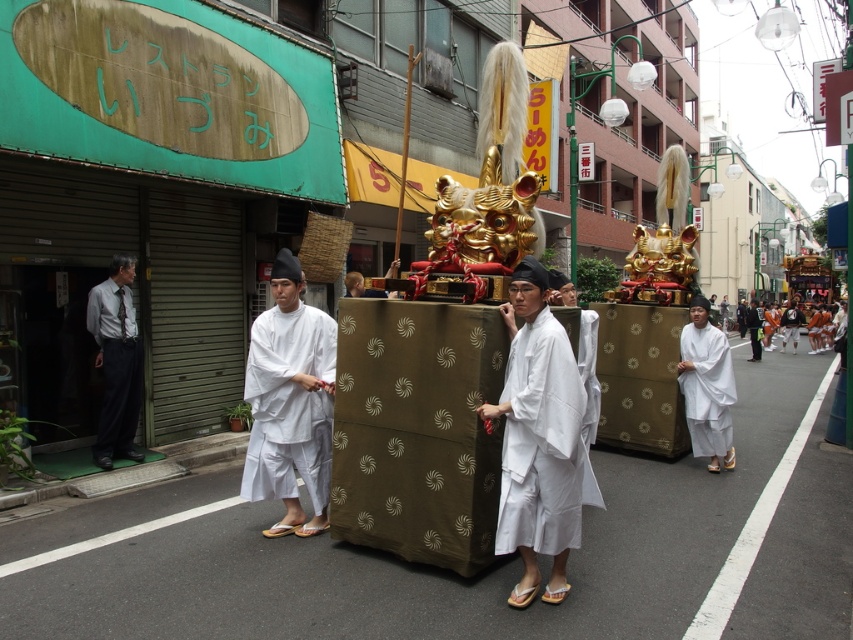
Question: Among these points, which one is nearest to the camera?

Choices:
 (A) (572, 422)
 (B) (782, 314)

Answer: (A)

Question: Considering the real-world distances, which object is closest to the orange cotton t-shirt at center?

Choices:
 (A) gray shirt and tie at left
 (B) white cotton robe at center
 (C) white silk robe at center

Answer: (C)

Question: Does white matte robe at right have a greater width compared to orange cotton t-shirt at center?

Choices:
 (A) yes
 (B) no

Answer: (B)

Question: Among these points, which one is farthest from the camera?

Choices:
 (A) (579, 522)
 (B) (814, 348)
 (C) (692, 403)
 (D) (299, 324)

Answer: (B)

Question: Can you confirm if white silk robe at center is positioned to the left of orange cotton t-shirt at center?

Choices:
 (A) no
 (B) yes

Answer: (B)

Question: Is gray shirt and tie at left in front of white matte robe at right?

Choices:
 (A) no
 (B) yes

Answer: (B)